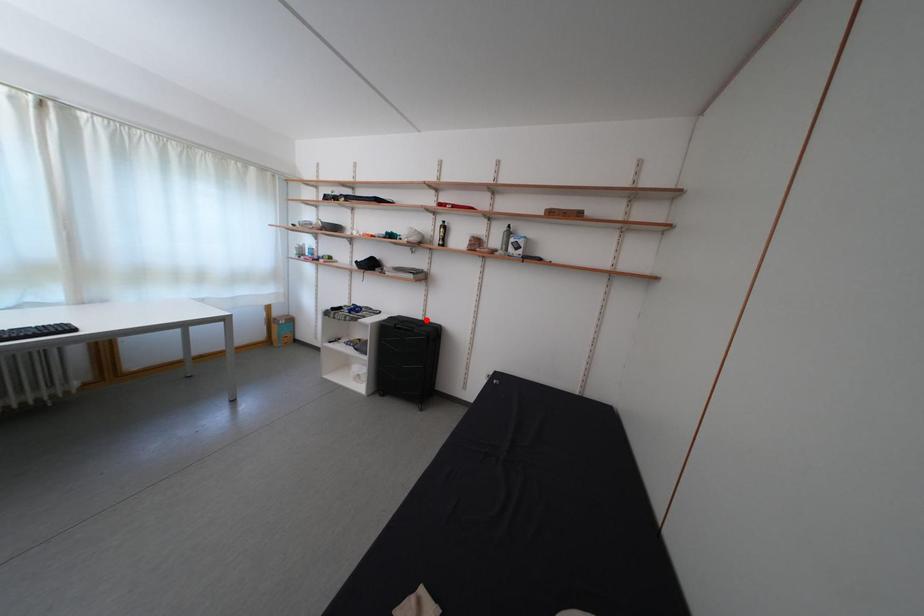
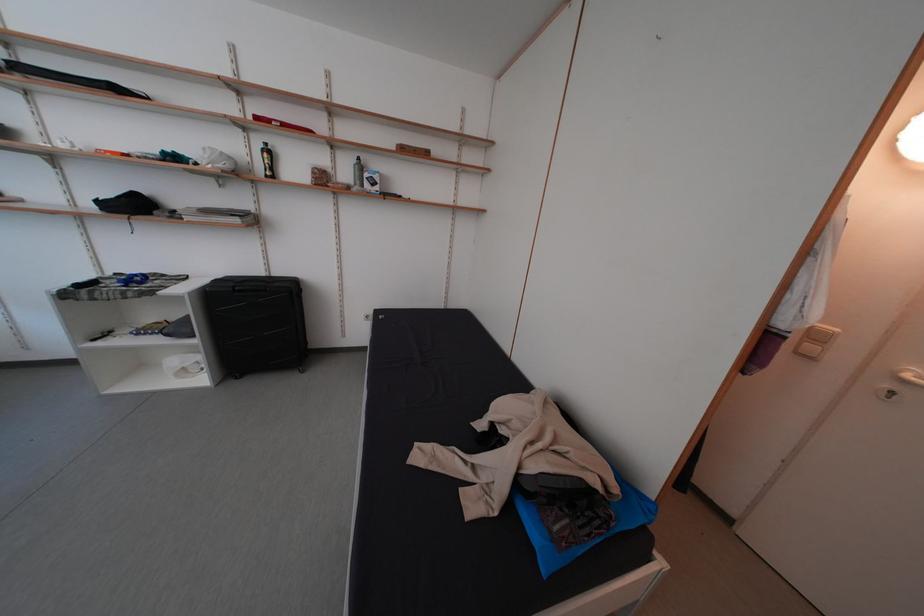
Question: I am providing you with two images of the same scene from different viewpoints. In image1, a red point is highlighted. Considering the same 3D point in image2, which of the following is correct?

Choices:
 (A) It is closer
 (B) It is farther

Answer: (A)